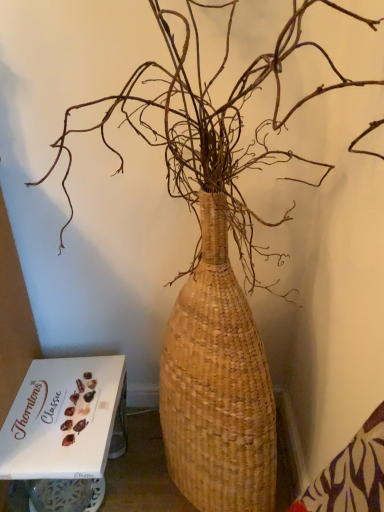
Image resolution: width=384 pixels, height=512 pixels. Describe the element at coordinates (62, 419) in the screenshot. I see `white cardboard box at lower left` at that location.

You are a GUI agent. You are given a task and a screenshot of the screen. Output one action in this format:
    pyautogui.click(x=<x>, y=<y>)
    Task: Click on the white cardboard box at lower left
    The width and height of the screenshot is (384, 512).
    Given the screenshot: What is the action you would take?
    pyautogui.click(x=62, y=419)

What is the approximate width of white cardboard box at lower left?

The width of white cardboard box at lower left is 33.55 centimeters.

Find the location of a particular element. The image size is (384, 512). white cardboard box at lower left is located at coordinates (62, 419).